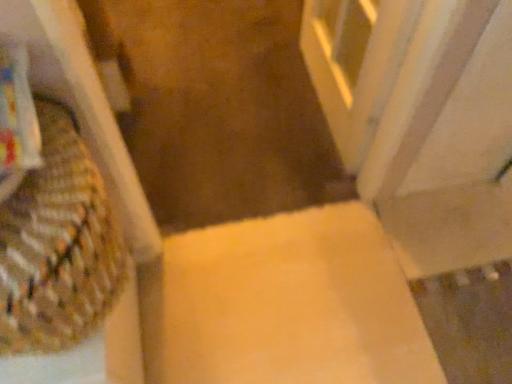
Question: Choose the correct answer: Is white marble screen door at upper right inside matte yellow cardboard box at center or outside it?

Choices:
 (A) outside
 (B) inside

Answer: (A)

Question: Is white marble screen door at upper right wider or thinner than matte yellow cardboard box at center?

Choices:
 (A) wide
 (B) thin

Answer: (B)

Question: Estimate the real-world distances between objects in this image. Which object is farther from the matte yellow cardboard box at center?

Choices:
 (A) yellow carpet at center
 (B) woven fabric basket at left
 (C) white marble screen door at upper right

Answer: (B)

Question: Based on their relative distances, which object is farther from the matte yellow cardboard box at center?

Choices:
 (A) white marble screen door at upper right
 (B) yellow carpet at center
 (C) woven fabric basket at left

Answer: (C)